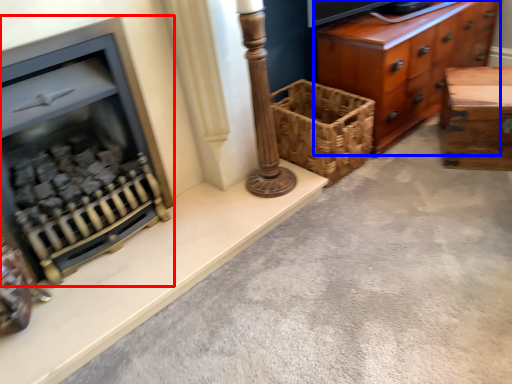
Question: Which of the following is the farthest to the observer, fireplace (highlighted by a red box) or chest of drawers (highlighted by a blue box)?

Choices:
 (A) fireplace
 (B) chest of drawers

Answer: (B)